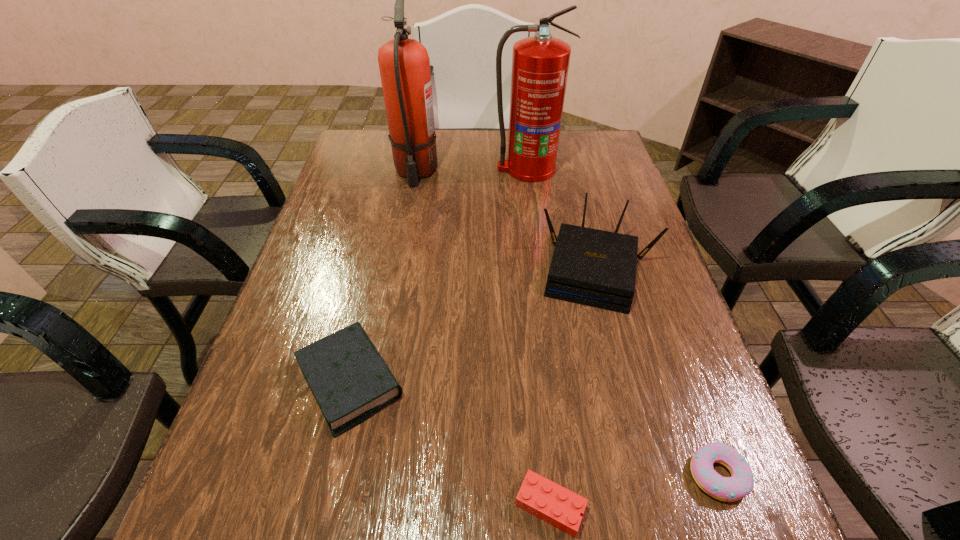
Image resolution: width=960 pixels, height=540 pixels. In the image, there is a desktop. Find the location of `free space at the right edge`. free space at the right edge is located at coordinates (618, 231).

What are the coordinates of `blank area at the far left corner` in the screenshot? It's located at (380, 159).

The height and width of the screenshot is (540, 960). What are the coordinates of `unoccupied area between the right fire extinguisher and the left fire extinguisher` in the screenshot? It's located at (471, 170).

The image size is (960, 540). What are the coordinates of `vacant point located between the right fire extinguisher and the third nearest object` in the screenshot? It's located at (439, 275).

Where is `free space that is in between the right fire extinguisher and the fourth farthest object`? The width and height of the screenshot is (960, 540). free space that is in between the right fire extinguisher and the fourth farthest object is located at coordinates (439, 275).

The height and width of the screenshot is (540, 960). Find the location of `vacant region between the right fire extinguisher and the left fire extinguisher`. vacant region between the right fire extinguisher and the left fire extinguisher is located at coordinates (471, 170).

The height and width of the screenshot is (540, 960). I want to click on vacant space that's between the Bible and the left fire extinguisher, so click(x=383, y=276).

You are a GUI agent. You are given a task and a screenshot of the screen. Output one action in this format:
    pyautogui.click(x=<x>, y=<y>)
    Task: Click on the free space between the left fire extinguisher and the right fire extinguisher
    This screenshot has height=540, width=960.
    Given the screenshot: What is the action you would take?
    pyautogui.click(x=471, y=170)

Find the location of a particular element. This screenshot has width=960, height=540. vacant region between the doughnut and the left fire extinguisher is located at coordinates (566, 323).

Locate an element on the screen. vacant space that is in between the third tallest object and the doughnut is located at coordinates (659, 372).